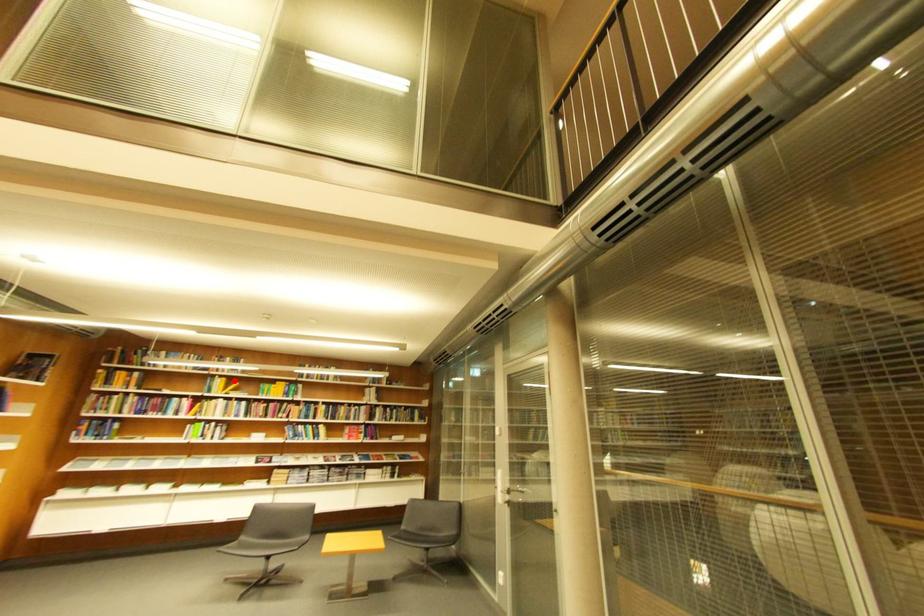
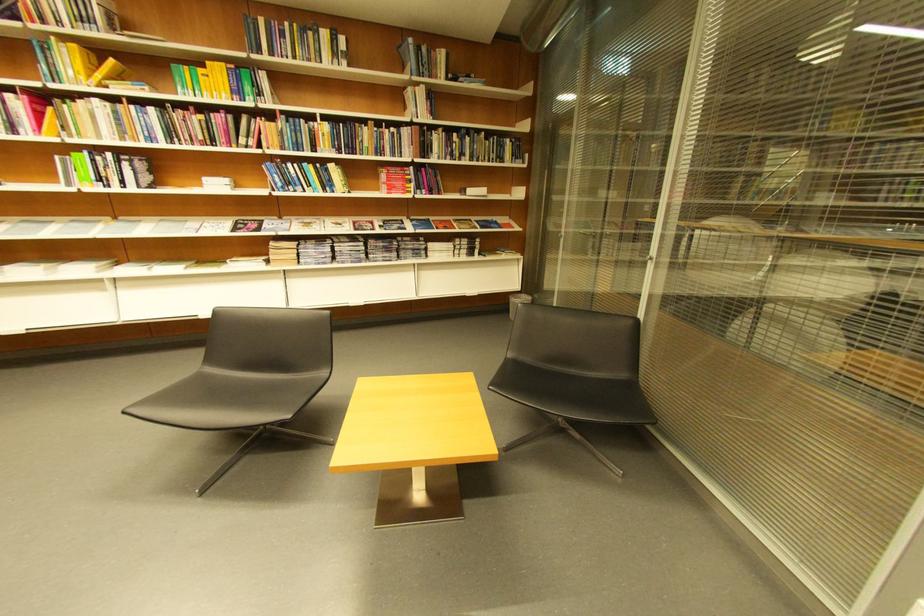
In the second image, find the point that corresponds to the highlighted location in the first image.

(84, 47)